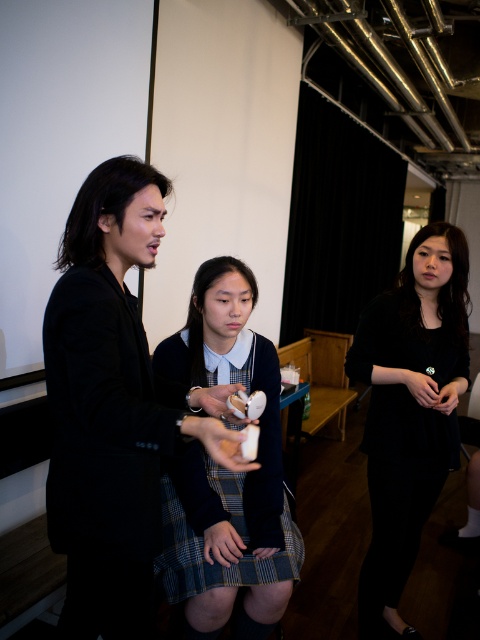
You are organizing a fashion show and need to place the plaid skirt at center and the black matte dress at right on a runway. The runway is 36 inches wide. Will the two outfits fit side by side on the runway without overlapping?

The plaid skirt at center is 36.55 inches from the black matte dress at right. Since the runway is only 36 inches wide, the two outfits will overlap slightly and not fit side by side without overlapping.

You are a photographer in the conference room. You need to capture a photo of both the plaid skirt at center and the matte white controller at center. Which object should you position to the left side of your frame to include both in the shot?

The plaid skirt at center is to the left of the matte white controller at center, so you should position the plaid skirt at center on the left side of your frame to include both in the shot.